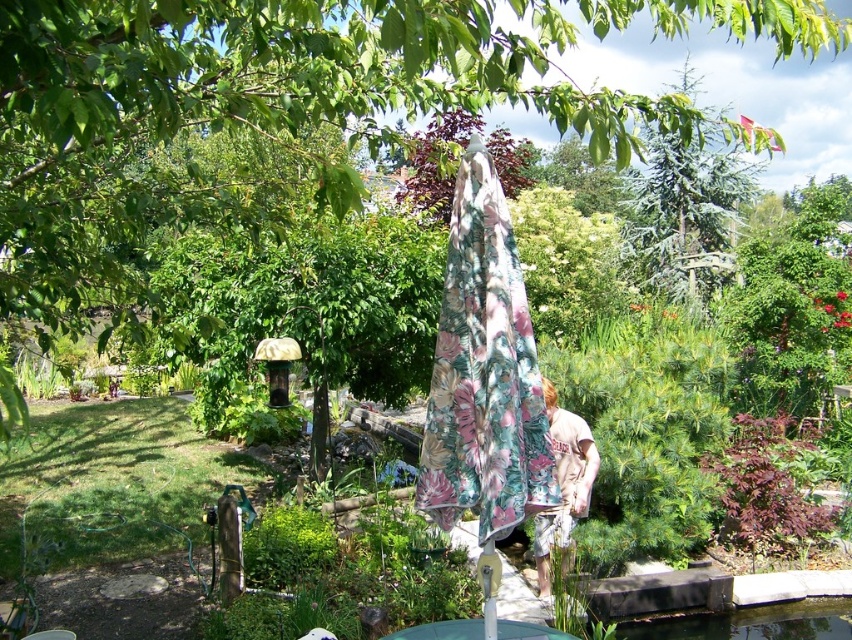
You are standing at the edge of the garden looking towards the transparent glass pond at lower center. Which direction should you walk to reach the green leafy tree at center?

You should walk to your left because the green leafy tree at center is located to the left of the transparent glass pond at lower center.

You are standing in the garden and want to walk from the point at coordinates (180, 115) to the point at coordinates (735, 609). Which direction should you face to move towards the second point?

You should face towards the direction of point (735, 609), which is behind point (180, 115) since point (180, 115) is in front of point (735, 609).